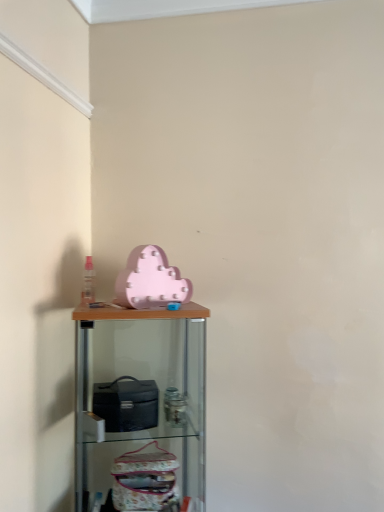
Question: In terms of height, does matte pink cloud at upper center look taller or shorter compared to pink matte cloud at upper center?

Choices:
 (A) tall
 (B) short

Answer: (B)

Question: Would you say matte pink cloud at upper center is to the left or to the right of pink matte cloud at upper center in the picture?

Choices:
 (A) left
 (B) right

Answer: (B)

Question: Based on their sizes in the image, would you say matte pink cloud at upper center is bigger or smaller than pink matte cloud at upper center?

Choices:
 (A) big
 (B) small

Answer: (B)

Question: Is pink matte cloud at upper center bigger or smaller than matte pink cloud at upper center?

Choices:
 (A) big
 (B) small

Answer: (A)

Question: Considering their positions, is pink matte cloud at upper center located in front of or behind matte pink cloud at upper center?

Choices:
 (A) behind
 (B) front

Answer: (B)

Question: Does point (187, 442) appear closer or farther from the camera than point (167, 261)?

Choices:
 (A) farther
 (B) closer

Answer: (B)

Question: In terms of height, does pink matte cloud at upper center look taller or shorter compared to matte pink cloud at upper center?

Choices:
 (A) tall
 (B) short

Answer: (A)